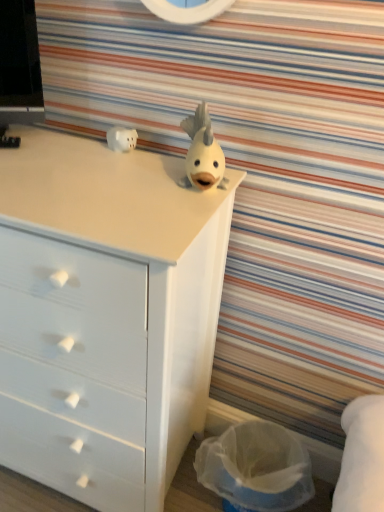
At what (x,y) coordinates should I click in order to perform the action: click on vacant area on top of white matte chest of drawers at upper center (from a real-world perspective). Please return your answer as a coordinate pair (x, y). Image resolution: width=384 pixels, height=512 pixels. Looking at the image, I should click on (78, 169).